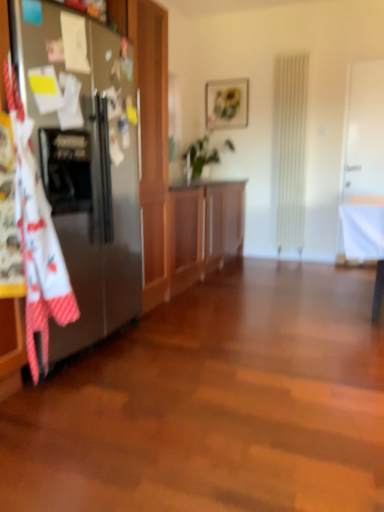
Question: From the image's perspective, is matte wooden picture frame at upper center above or below wooden cabinet at center?

Choices:
 (A) below
 (B) above

Answer: (B)

Question: From a real-world perspective, relative to wooden cabinet at center, is matte wooden picture frame at upper center vertically above or below?

Choices:
 (A) below
 (B) above

Answer: (B)

Question: Based on their relative distances, which object is farther from the satin silver refrigerator at left?

Choices:
 (A) matte wooden picture frame at upper center
 (B) green leafy plant at center
 (C) wooden cabinet at center

Answer: (A)

Question: Based on their relative distances, which object is farther from the green leafy plant at center?

Choices:
 (A) wooden cabinet at center
 (B) matte wooden picture frame at upper center
 (C) satin silver refrigerator at left

Answer: (C)